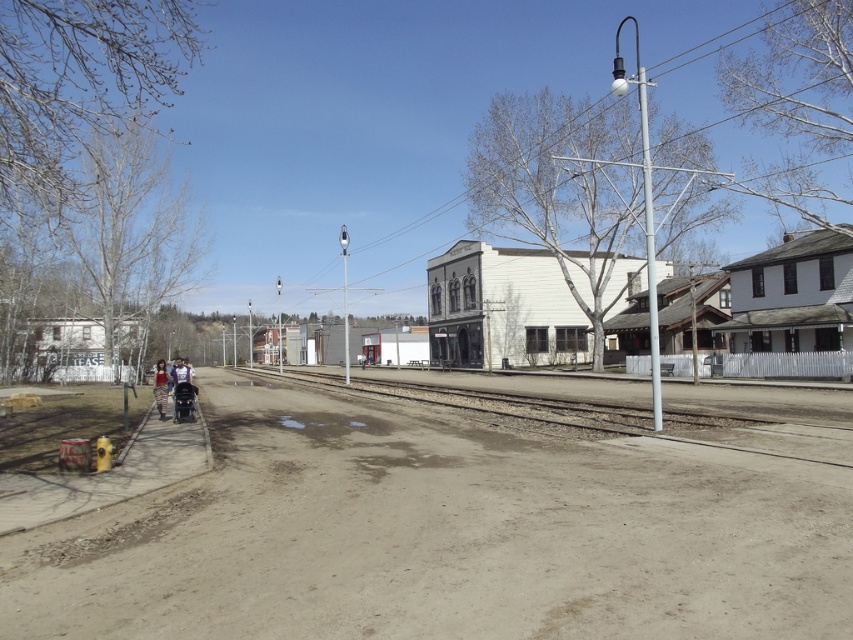
Between brown sandy dirt track at lower center and brown gravel train track at center, which one has more height?

brown gravel train track at center

Does point (798, 616) lie behind point (598, 396)?

That is False.

At what (x,y) coordinates should I click in order to perform the action: click on brown sandy dirt track at lower center. Please return your answer as a coordinate pair (x, y). Image resolution: width=853 pixels, height=640 pixels. Looking at the image, I should click on (450, 531).